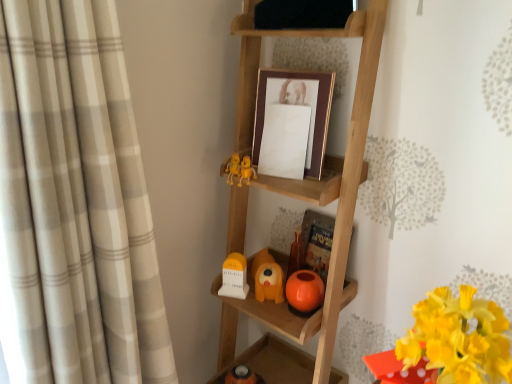
Question: From a real-world perspective, does wooden ladder at center, which is the 1th shelf in bottom-to-top order, sit lower than beige plaid curtain at left?

Choices:
 (A) no
 (B) yes

Answer: (B)

Question: Is wooden ladder at center, which is the 1th shelf in bottom-to-top order, positioned in front of beige plaid curtain at left?

Choices:
 (A) no
 (B) yes

Answer: (A)

Question: Can you see wooden ladder at center, which is the 1th shelf in bottom-to-top order, touching beige plaid curtain at left?

Choices:
 (A) yes
 (B) no

Answer: (B)

Question: Is wooden ladder at center, the second shelf viewed from the top, positioned beyond the bounds of beige plaid curtain at left?

Choices:
 (A) yes
 (B) no

Answer: (A)

Question: Is wooden ladder at center, the second shelf viewed from the top, looking in the opposite direction of beige plaid curtain at left?

Choices:
 (A) no
 (B) yes

Answer: (B)

Question: From the image's perspective, would you say wooden ladder at center, the second shelf viewed from the top, is shown under beige plaid curtain at left?

Choices:
 (A) yes
 (B) no

Answer: (A)

Question: Is yellow matte flower at lower right to the right of wooden ladder at center, the second shelf viewed from the top, from the viewer's perspective?

Choices:
 (A) yes
 (B) no

Answer: (A)

Question: Does yellow matte flower at lower right appear on the left side of wooden ladder at center, which is the 1th shelf in bottom-to-top order?

Choices:
 (A) yes
 (B) no

Answer: (B)

Question: Considering the relative sizes of yellow matte flower at lower right and wooden ladder at center, which is the 1th shelf in bottom-to-top order, in the image provided, is yellow matte flower at lower right taller than wooden ladder at center, which is the 1th shelf in bottom-to-top order,?

Choices:
 (A) yes
 (B) no

Answer: (B)

Question: Can you confirm if yellow matte flower at lower right is wider than wooden ladder at center, which is the 1th shelf in bottom-to-top order?

Choices:
 (A) no
 (B) yes

Answer: (A)

Question: Can you see yellow matte flower at lower right touching wooden ladder at center, the second shelf viewed from the top?

Choices:
 (A) no
 (B) yes

Answer: (A)

Question: From a real-world perspective, is yellow matte flower at lower right positioned over wooden ladder at center, the second shelf viewed from the top, based on gravity?

Choices:
 (A) yes
 (B) no

Answer: (A)

Question: Is yellow matte flower at lower right behind white matte clock at lower center, which is the first toy in left-to-right order?

Choices:
 (A) no
 (B) yes

Answer: (A)